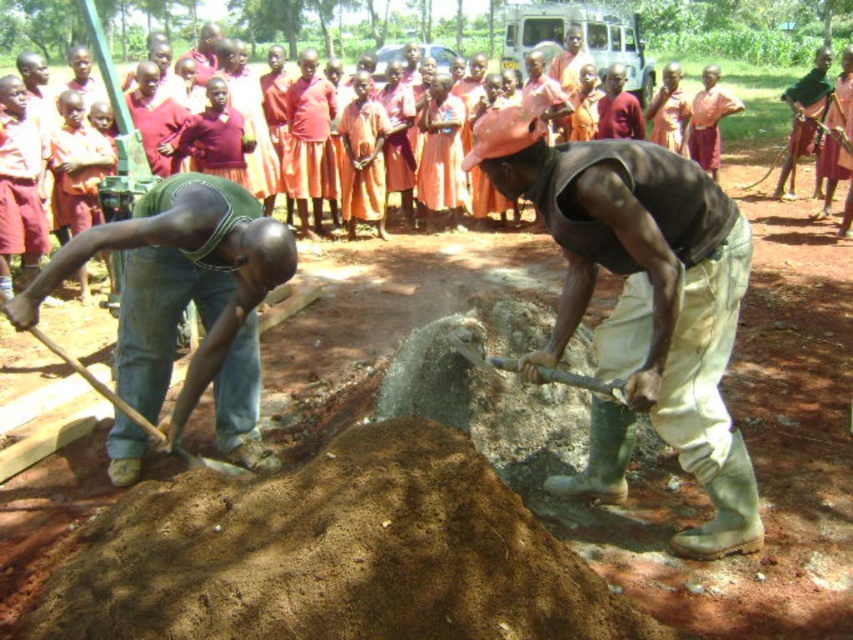
Question: Can you confirm if brown dirt mound at center is positioned below matte green vest at center?

Choices:
 (A) yes
 (B) no

Answer: (A)

Question: Which point is farther from the camera taking this photo?

Choices:
 (A) (699, 120)
 (B) (660, 204)
 (C) (125, 401)
 (D) (602, 390)

Answer: (A)

Question: Among these points, which one is farthest from the camera?

Choices:
 (A) (225, 461)
 (B) (608, 211)
 (C) (537, 572)
 (D) (726, 97)

Answer: (D)

Question: Is orange fabric shirt at upper center in front of wooden shovel at center?

Choices:
 (A) no
 (B) yes

Answer: (A)

Question: Which point is farther to the camera?

Choices:
 (A) (705, 115)
 (B) (622, 394)

Answer: (A)

Question: From the image, what is the correct spatial relationship of brown dirt mound at center in relation to matte green vest at center?

Choices:
 (A) above
 (B) below

Answer: (B)